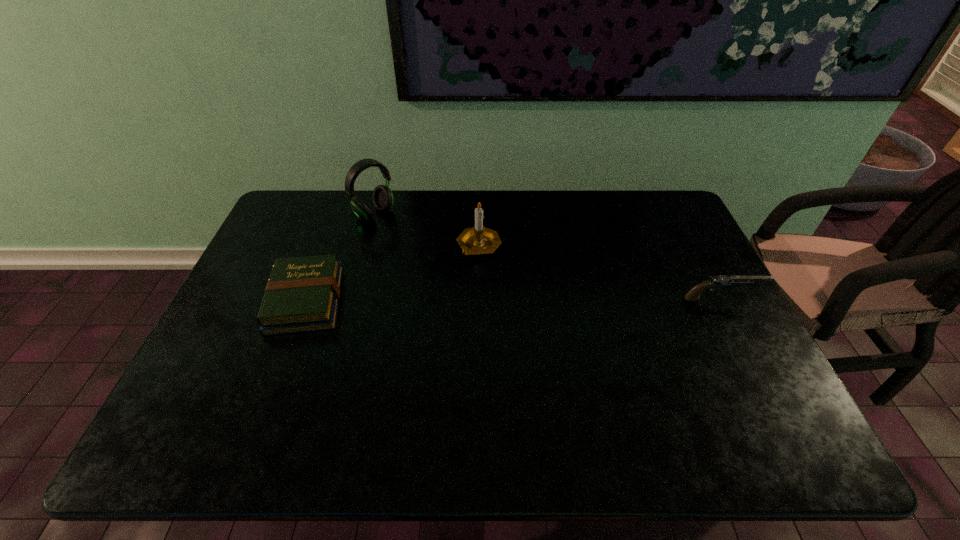
Where is `free space located on the ear cups of the farthest object`? free space located on the ear cups of the farthest object is located at coordinates (410, 242).

This screenshot has height=540, width=960. Identify the location of free space located 0.290m with a handle on the second tallest object. (460, 339).

I want to click on vacant space located with a handle on the second tallest object, so click(x=469, y=291).

At what (x,y) coordinates should I click in order to perform the action: click on free point located with a handle on the second tallest object. Please return your answer as a coordinate pair (x, y). Looking at the image, I should click on (467, 307).

Find the location of `headset at the far edge`. headset at the far edge is located at coordinates (383, 199).

Identify the location of candle holder present at the far edge. This screenshot has width=960, height=540. (478, 240).

I want to click on object that is at the left edge, so click(x=302, y=294).

Identify the location of object that is at the right edge. Image resolution: width=960 pixels, height=540 pixels. (717, 281).

The width and height of the screenshot is (960, 540). Find the location of `vacant space at the far edge of the desktop`. vacant space at the far edge of the desktop is located at coordinates (x=391, y=227).

Find the location of a particular element. vacant space at the near edge of the desktop is located at coordinates (688, 378).